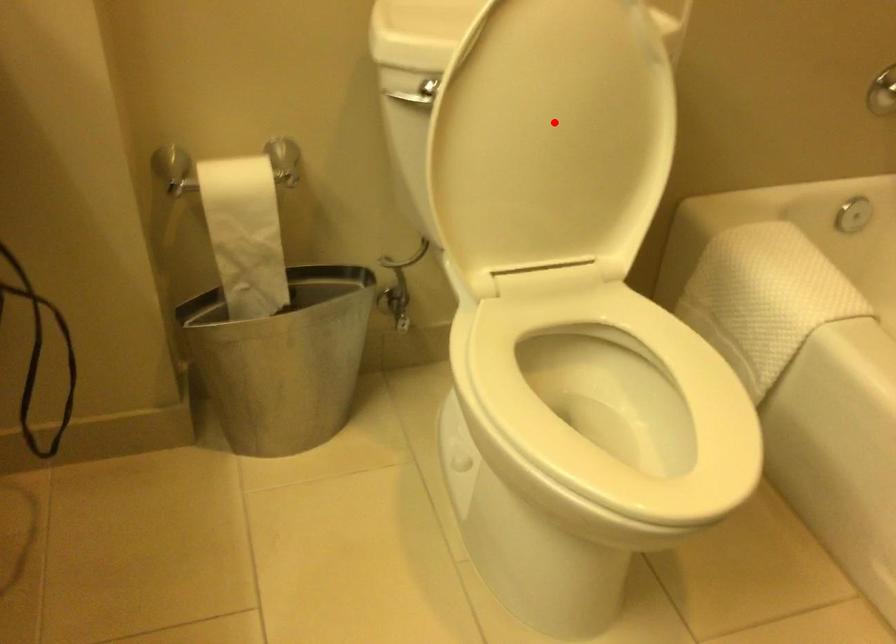
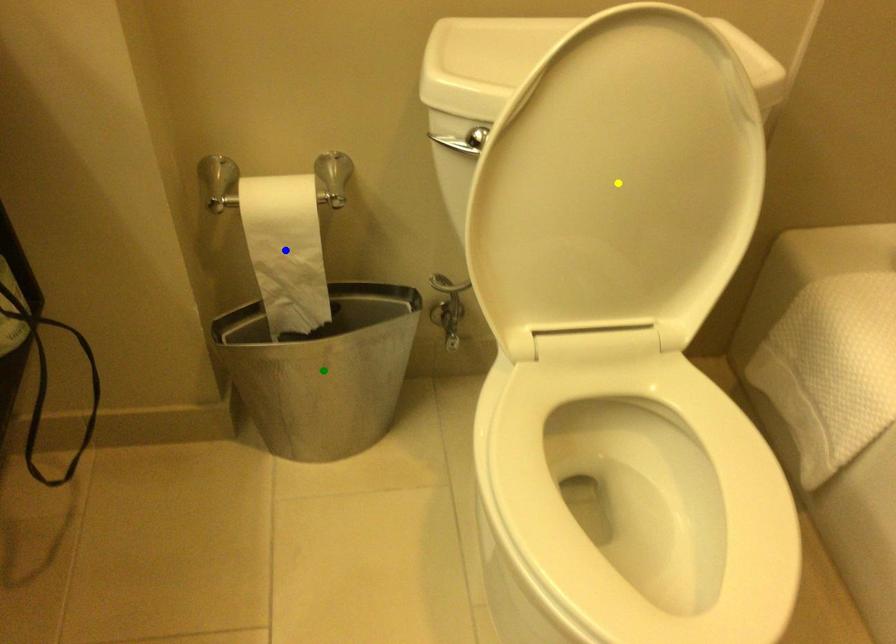
Question: I am providing you with two images of the same scene from different viewpoints. A red point is marked on the first image. You are given multiple points on the second image. Which point in image 2 represents the same 3d spot as the red point in image 1?

Choices:
 (A) blue point
 (B) green point
 (C) yellow point

Answer: (C)